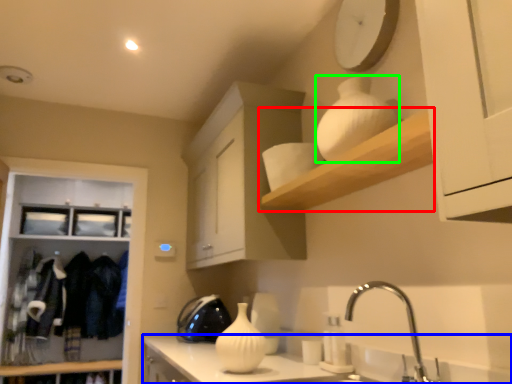
Question: Based on their relative distances, which object is nearer to shelf (highlighted by a red box)? Choose from countertop (highlighted by a blue box) and glass vase (highlighted by a green box).

Choices:
 (A) countertop
 (B) glass vase

Answer: (B)